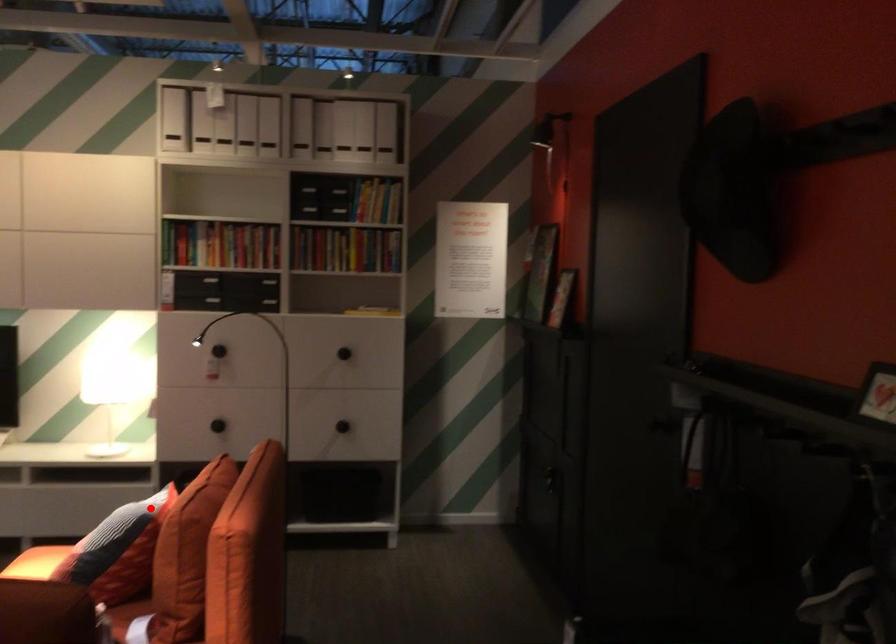
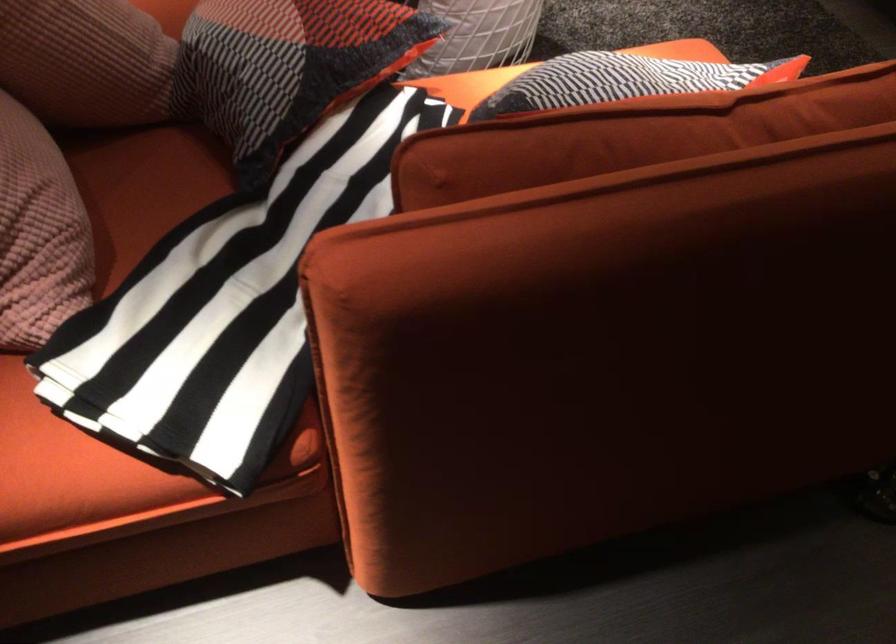
Question: I am providing you with two images of the same scene from different viewpoints. Given a red point in image1, look at the same physical point in image2. Is it:

Choices:
 (A) Closer to the viewpoint
 (B) Farther from the viewpoint

Answer: (A)